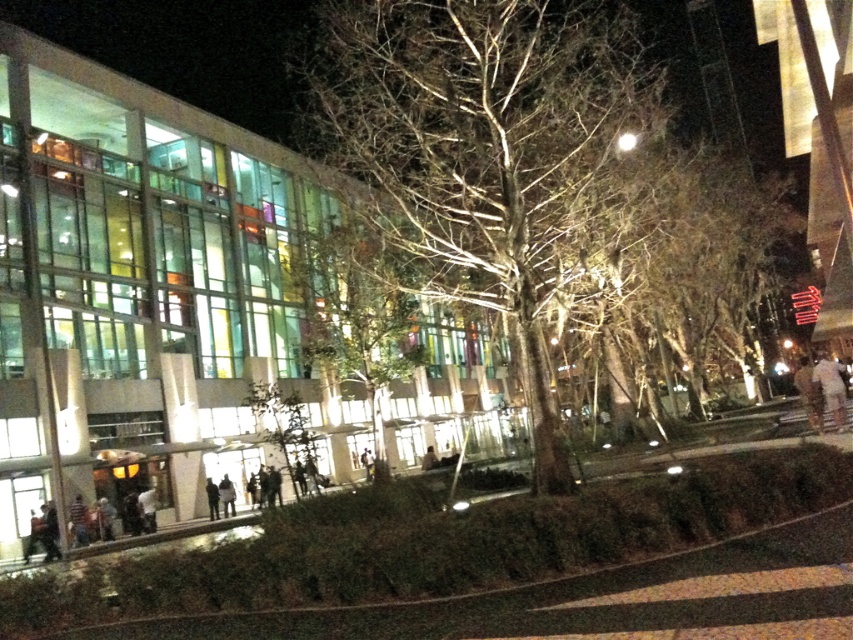
Question: Among these points, which one is farthest from the camera?

Choices:
 (A) (556, 278)
 (B) (228, 492)
 (C) (215, 497)

Answer: (B)

Question: Which of the following is the closest to the observer?

Choices:
 (A) (227, 493)
 (B) (218, 506)
 (C) (509, 278)

Answer: (C)

Question: Is dark gray jacket at lower center behind dark gray fabric jacket at lower left?

Choices:
 (A) yes
 (B) no

Answer: (A)

Question: Which of the following is the closest to the observer?

Choices:
 (A) (502, 164)
 (B) (216, 492)
 (C) (228, 509)

Answer: (A)

Question: Can you confirm if dark gray jacket at lower center is positioned to the left of dark gray fabric jacket at lower left?

Choices:
 (A) yes
 (B) no

Answer: (B)

Question: From the image, what is the correct spatial relationship of bare branches at center in relation to dark gray jacket at lower center?

Choices:
 (A) right
 (B) left

Answer: (A)